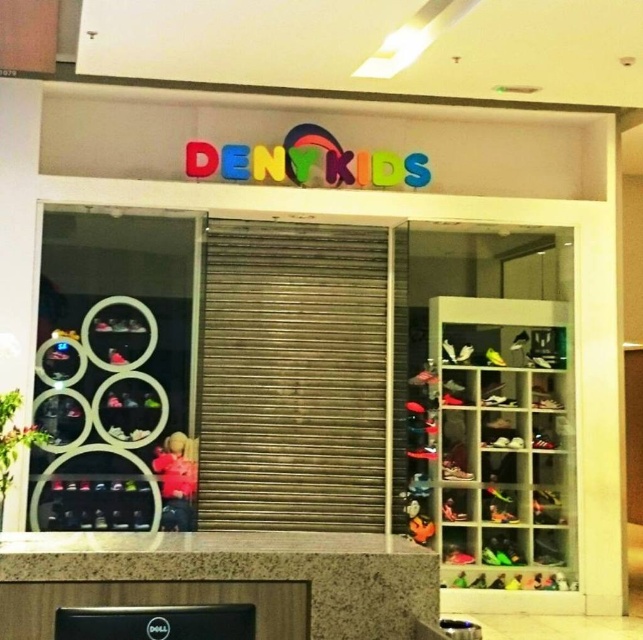
Who is positioned more to the right, shiny plastic shoes at right or pink fabric doll at center?

Positioned to the right is shiny plastic shoes at right.

Which is behind, point (566, 305) or point (179, 486)?

Point (566, 305)

Where is `shiny plastic shoes at right`? shiny plastic shoes at right is located at coordinates (493, 444).